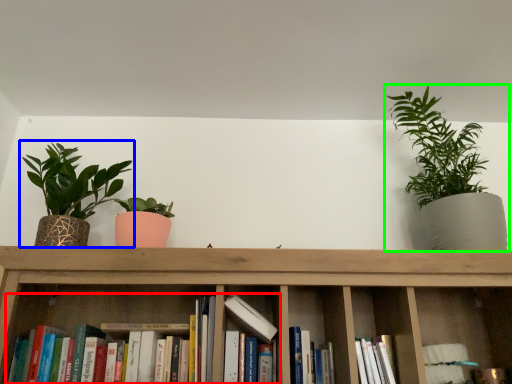
Question: Based on their relative distances, which object is nearer to book (highlighted by a red box)? Choose from houseplant (highlighted by a blue box) and houseplant (highlighted by a green box).

Choices:
 (A) houseplant
 (B) houseplant

Answer: (A)